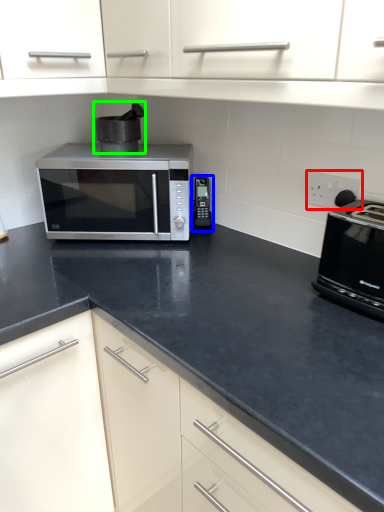
Question: Which object is positioned farthest from electric outlet (highlighted by a red box)? Select from appliance (highlighted by a blue box) and appliance (highlighted by a green box).

Choices:
 (A) appliance
 (B) appliance

Answer: (B)